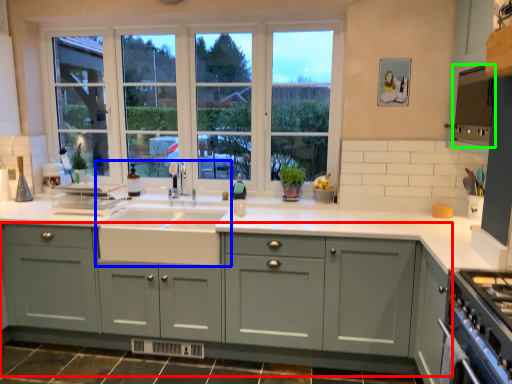
Question: Considering the real-world distances, which object is closest to cabinetry (highlighted by a red box)? sink (highlighted by a blue box) or appliance (highlighted by a green box).

Choices:
 (A) sink
 (B) appliance

Answer: (A)